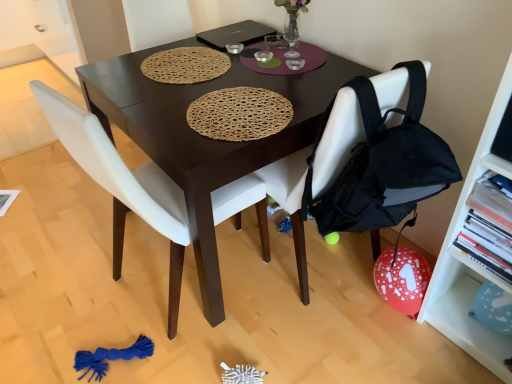
Identify the location of empty space that is in between black fabric chair at center, the first chair when ordered from right to left, and dark wood table at center. (289, 299).